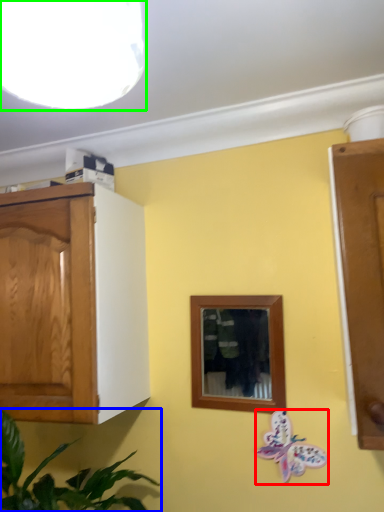
Question: Which object is positioned farthest from butterfly (highlighted by a red box)? Select from houseplant (highlighted by a blue box) and light fixture (highlighted by a green box).

Choices:
 (A) houseplant
 (B) light fixture

Answer: (B)